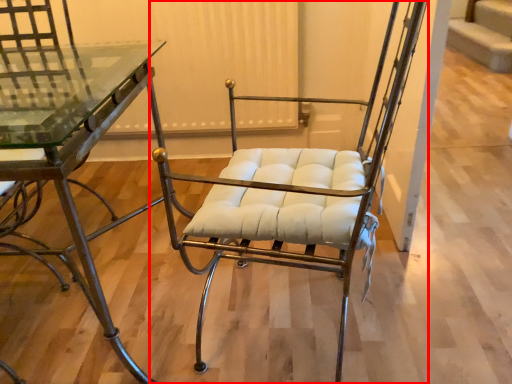
Question: From the image's perspective, where is chair (annotated by the red box) located relative to table?

Choices:
 (A) below
 (B) above

Answer: (B)